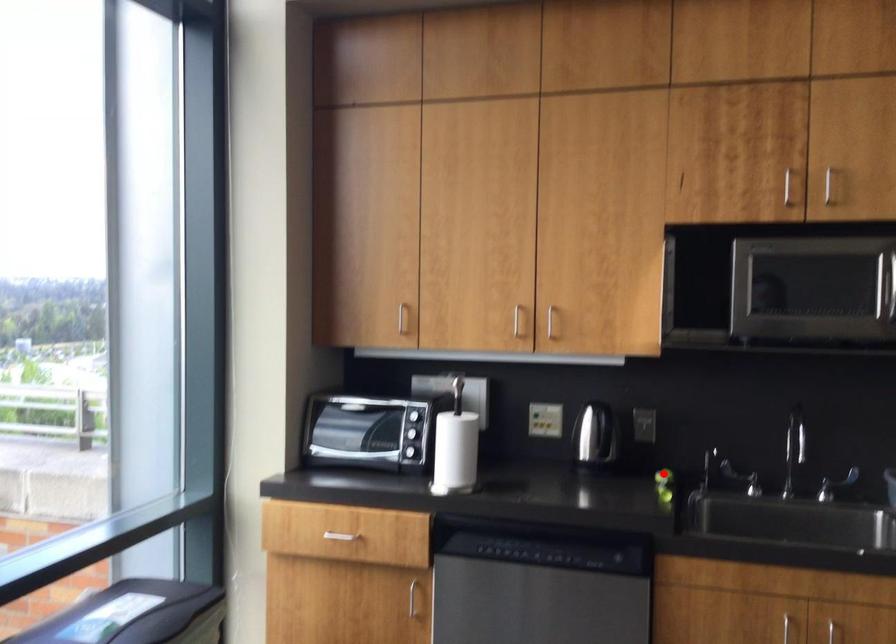
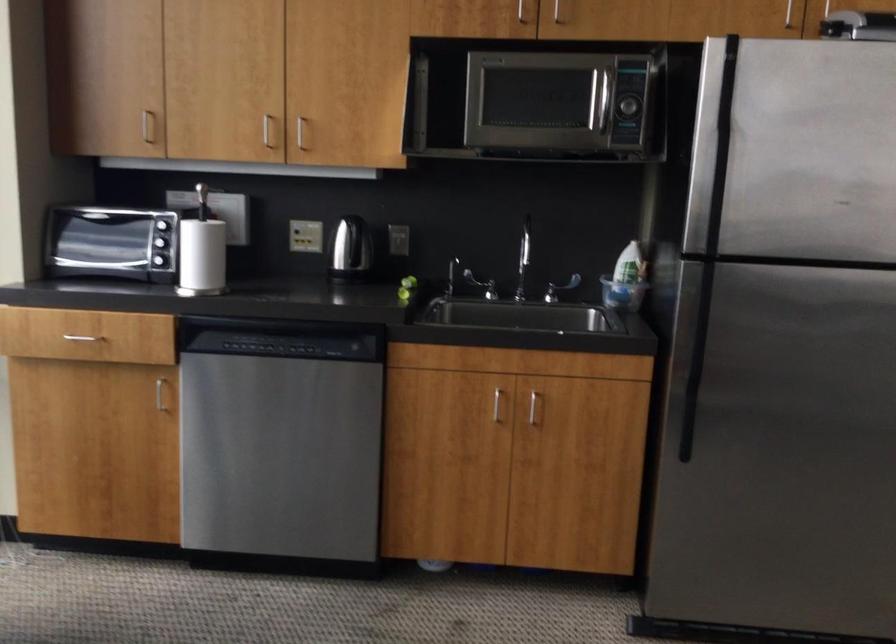
Question: I am providing you with two images of the same scene from different viewpoints. In image1, a red point is highlighted. Considering the same 3D point in image2, which of the following is correct?

Choices:
 (A) It is closer
 (B) It is farther

Answer: (B)